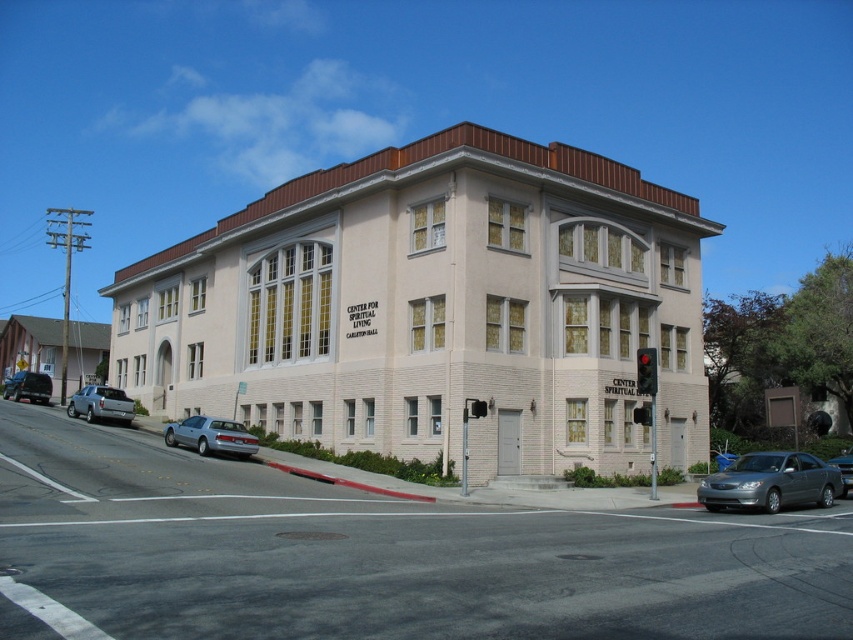
Does gray metallic sedan at lower right have a greater height compared to silver metallic sedan at lower left?

Indeed, gray metallic sedan at lower right has a greater height compared to silver metallic sedan at lower left.

Is point (811, 502) farther from camera compared to point (198, 436)?

No, it is in front of (198, 436).

Identify the location of gray metallic sedan at lower right. (770, 483).

Does silver metallic sedan at lower left appear on the left side of matte black suv at lower left?

In fact, silver metallic sedan at lower left is to the right of matte black suv at lower left.

Which of these two, silver metallic sedan at lower left or matte black suv at lower left, stands taller?

Standing taller between the two is matte black suv at lower left.

The height and width of the screenshot is (640, 853). Describe the element at coordinates (212, 436) in the screenshot. I see `silver metallic sedan at lower left` at that location.

Where is `silver metallic sedan at lower left`? The height and width of the screenshot is (640, 853). silver metallic sedan at lower left is located at coordinates (212, 436).

Which is in front, point (196, 440) or point (846, 461)?

Point (846, 461) is more forward.

Is silver metallic sedan at lower left wider than silver metallic sedan at center?

No.

Identify the location of silver metallic sedan at lower left. (212, 436).